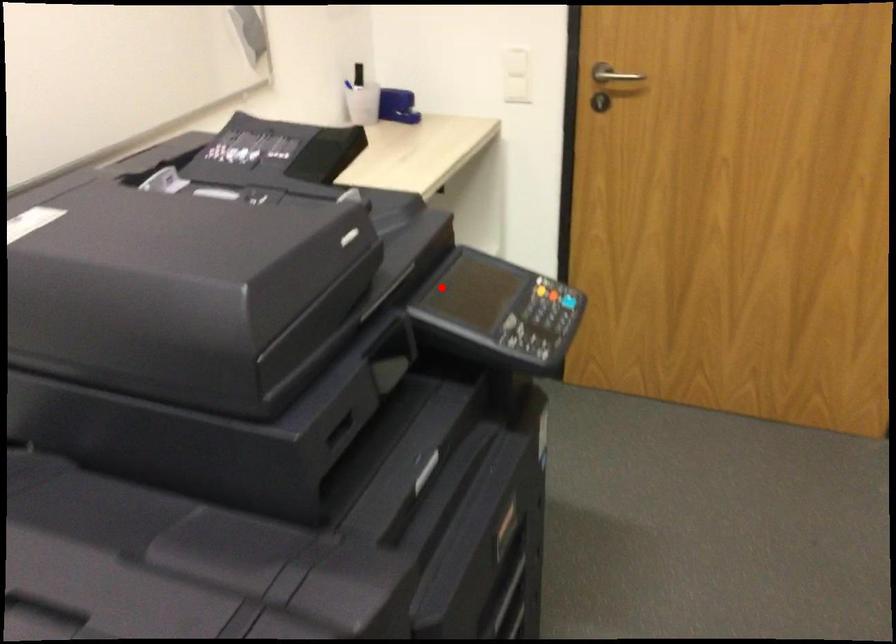
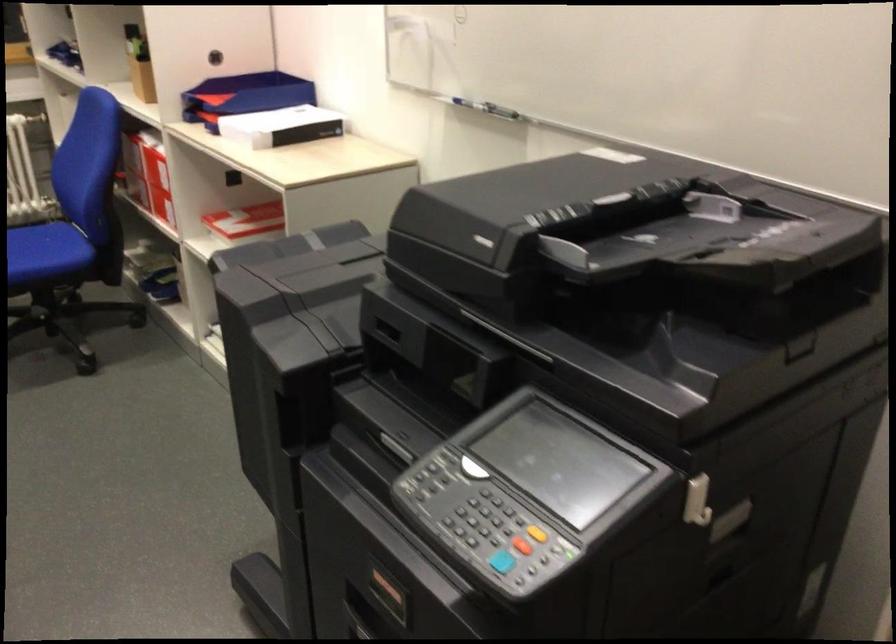
Where in the second image is the point corresponding to the highlighted location from the first image?

(696, 500)